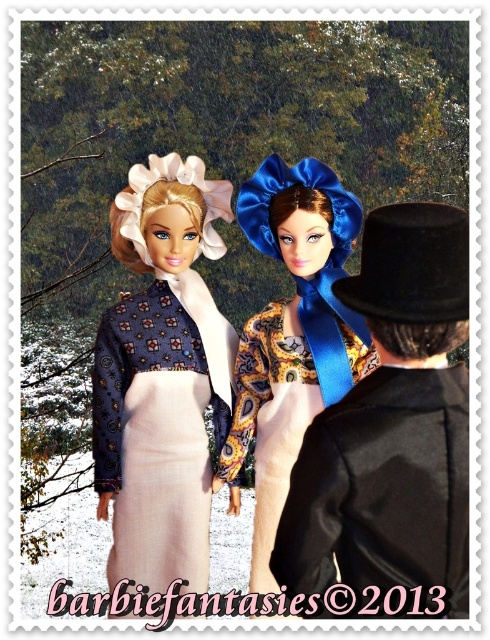
What do you see at coordinates (162, 376) in the screenshot?
I see `matte blue fabric dress at center` at bounding box center [162, 376].

Where is `matte blue fabric dress at center`? This screenshot has height=640, width=490. matte blue fabric dress at center is located at coordinates (162, 376).

Image resolution: width=490 pixels, height=640 pixels. I want to click on matte blue fabric dress at center, so click(162, 376).